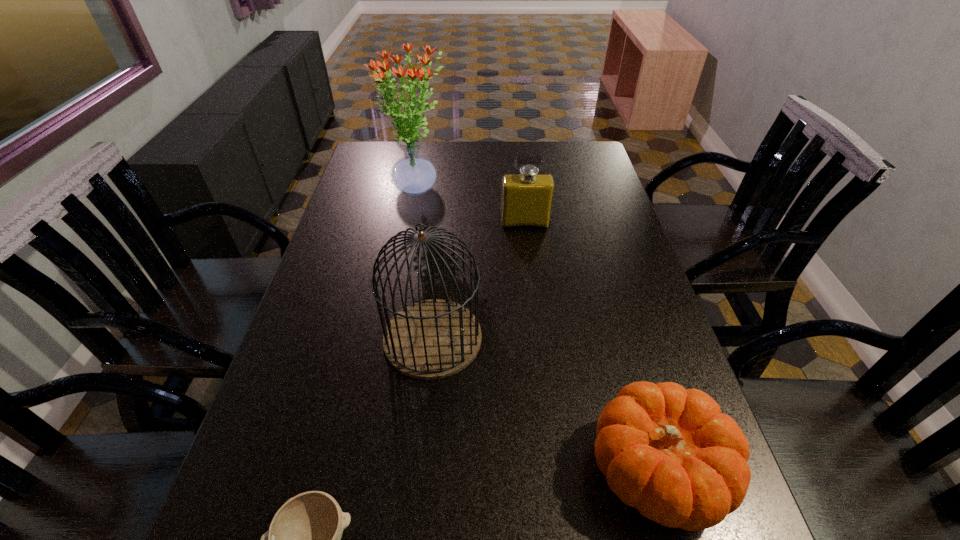
This screenshot has width=960, height=540. I want to click on the farthest object, so click(413, 174).

Locate an element on the screen. This screenshot has width=960, height=540. flower arrangement is located at coordinates (413, 174).

Find the location of a particular element. Image resolution: width=960 pixels, height=540 pixels. birdcage is located at coordinates 431,339.

Locate an element on the screen. This screenshot has height=540, width=960. the fourth shortest object is located at coordinates (431, 339).

The height and width of the screenshot is (540, 960). Find the location of `the fourth nearest object`. the fourth nearest object is located at coordinates (527, 197).

Locate an element on the screen. This screenshot has height=540, width=960. perfume is located at coordinates (527, 197).

Where is `vacant space located on the front of the farthest object`? The height and width of the screenshot is (540, 960). vacant space located on the front of the farthest object is located at coordinates (411, 221).

Where is `free space located 0.100m at the door of the birdcage`? This screenshot has width=960, height=540. free space located 0.100m at the door of the birdcage is located at coordinates (524, 338).

Identify the location of vacant area situated 0.140m on the front-facing side of the perfume. (529, 260).

Where is `object that is positioned at the far edge`? The height and width of the screenshot is (540, 960). object that is positioned at the far edge is located at coordinates (413, 174).